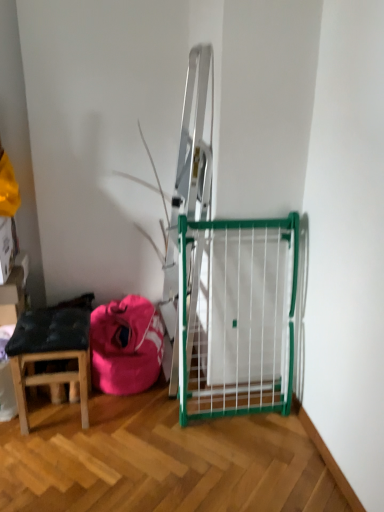
Question: Is wooden stool at lower left oriented away from pink fabric bean bag at lower left?

Choices:
 (A) no
 (B) yes

Answer: (A)

Question: Can you confirm if wooden stool at lower left is shorter than pink fabric bean bag at lower left?

Choices:
 (A) yes
 (B) no

Answer: (B)

Question: Could pink fabric bean bag at lower left be considered to be inside wooden stool at lower left?

Choices:
 (A) no
 (B) yes

Answer: (A)

Question: Is the position of wooden stool at lower left less distant than that of pink fabric bean bag at lower left?

Choices:
 (A) yes
 (B) no

Answer: (A)

Question: From a real-world perspective, is wooden stool at lower left beneath pink fabric bean bag at lower left?

Choices:
 (A) no
 (B) yes

Answer: (A)

Question: Considering the relative sizes of wooden stool at lower left and pink fabric bean bag at lower left in the image provided, is wooden stool at lower left thinner than pink fabric bean bag at lower left?

Choices:
 (A) no
 (B) yes

Answer: (B)

Question: Are pink fabric bean bag at lower left and wooden stool at lower left making contact?

Choices:
 (A) yes
 (B) no

Answer: (B)

Question: Can you confirm if pink fabric bean bag at lower left is bigger than wooden stool at lower left?

Choices:
 (A) no
 (B) yes

Answer: (B)

Question: Does pink fabric bean bag at lower left have a lesser width compared to wooden stool at lower left?

Choices:
 (A) no
 (B) yes

Answer: (A)

Question: From the image's perspective, is pink fabric bean bag at lower left on top of wooden stool at lower left?

Choices:
 (A) yes
 (B) no

Answer: (A)

Question: Does pink fabric bean bag at lower left come behind wooden stool at lower left?

Choices:
 (A) yes
 (B) no

Answer: (A)

Question: Is pink fabric bean bag at lower left wider than wooden stool at lower left?

Choices:
 (A) no
 (B) yes

Answer: (B)

Question: Considering the relative positions of pink fabric bean bag at lower left and wooden stool at lower left in the image provided, is pink fabric bean bag at lower left to the left or to the right of wooden stool at lower left?

Choices:
 (A) left
 (B) right

Answer: (B)